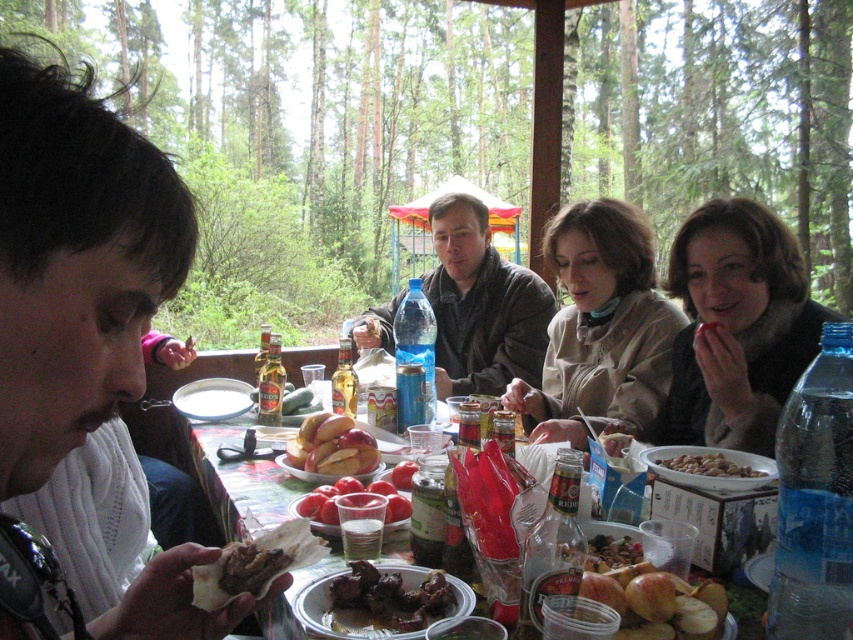
You are sitting at the table and want to reach for the shiny golden apples at center. Where exactly are they located relative to your position?

The shiny golden apples at center are located at coordinates point (332,445), so they are positioned slightly to the right and forward from your current seating position at the table.

You are a guest at the picnic and want to grab both the shiny golden apples at center and the shiny plastic container at center. If you can only reach 50 centimeters, can you reach both without moving your chair?

The shiny golden apples at center is 52.03 centimeters away from the shiny plastic container at center, so you cannot reach both without moving your chair since the distance exceeds your 50 centimeter reach.